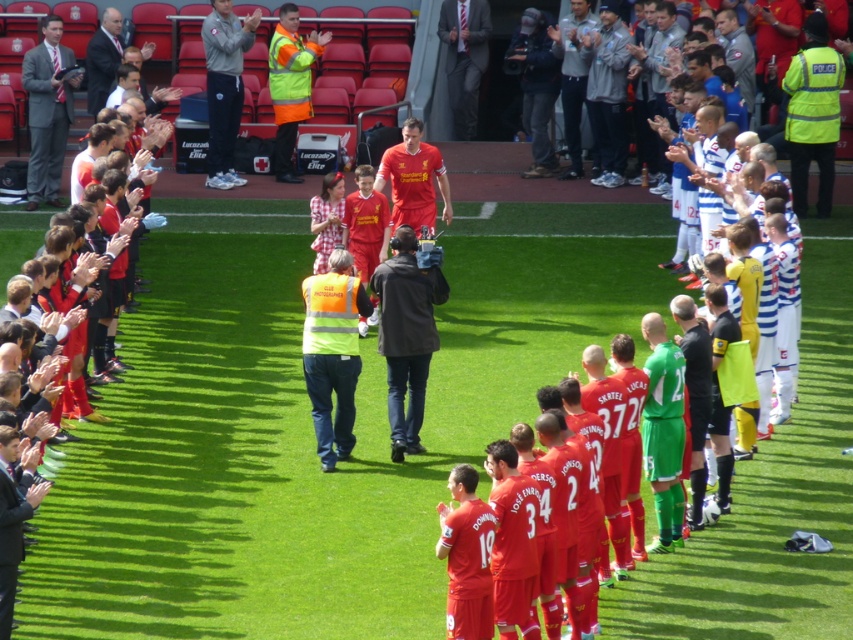
You are a photographer at the stadium and need to capture a photo that includes both the high visibility jacket at upper right and the dark gray suit at lower left. Based on their sizes, which one should you focus on first to ensure both are clearly visible in the frame?

The high visibility jacket at upper right is larger in size than the dark gray suit at lower left, so you should focus on the high visibility jacket at upper right first to ensure both are clearly visible in the frame.

You are a photographer at the football stadium and need to capture a photo of the two individuals wearing high visibility clothing. Which of the two, the high visibility vest at center or the high visibility jacket at upper right, would appear narrower in the photo?

The high visibility vest at center is thinner than the high visibility jacket at upper right, so it would appear narrower in the photo.